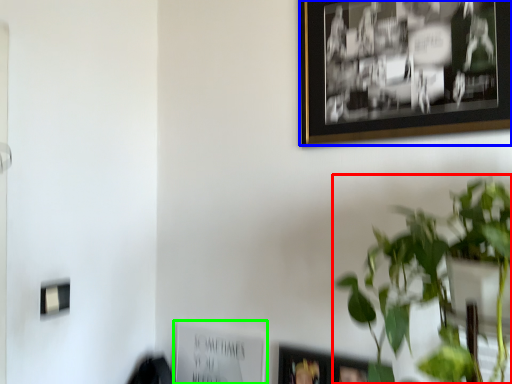
Question: Considering the real-world distances, which object is closest to houseplant (highlighted by a red box)? picture frame (highlighted by a blue box) or picture frame (highlighted by a green box).

Choices:
 (A) picture frame
 (B) picture frame

Answer: (A)